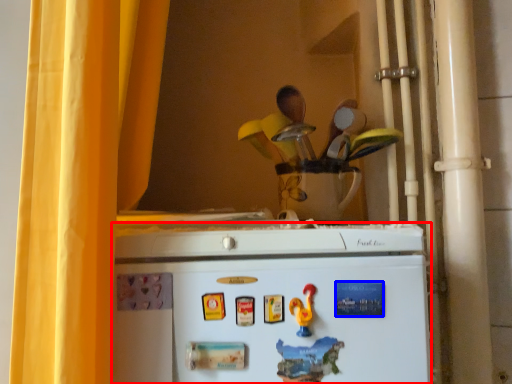
Question: Which object is further to the camera taking this photo, refrigerator (highlighted by a red box) or magnet (highlighted by a blue box)?

Choices:
 (A) refrigerator
 (B) magnet

Answer: (B)